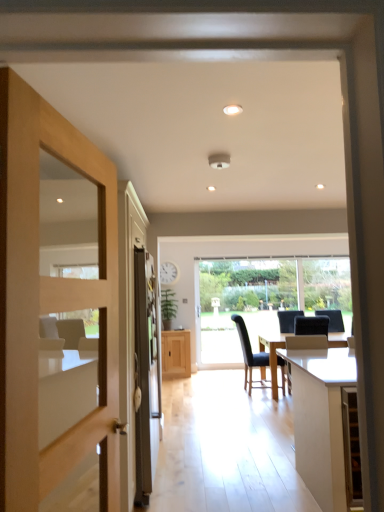
Question: Can you confirm if black leather chair at center, which is the second chair from left to right, is taller than white glossy table at lower right?

Choices:
 (A) no
 (B) yes

Answer: (B)

Question: From a real-world perspective, is black leather chair at center, which is the second chair from left to right, under white glossy table at lower right?

Choices:
 (A) yes
 (B) no

Answer: (B)

Question: Does black leather chair at center, which is counted as the first chair, starting from the right, appear on the right side of white glossy table at lower right?

Choices:
 (A) no
 (B) yes

Answer: (B)

Question: From a real-world perspective, is black leather chair at center, which is counted as the first chair, starting from the right, on top of white glossy table at lower right?

Choices:
 (A) no
 (B) yes

Answer: (B)

Question: Can you see black leather chair at center, which is counted as the first chair, starting from the right, touching white glossy table at lower right?

Choices:
 (A) yes
 (B) no

Answer: (B)

Question: Would you say transparent glass window at center is to the left or to the right of black leather chair at center, which is counted as the first chair, starting from the right, in the picture?

Choices:
 (A) left
 (B) right

Answer: (A)

Question: From the image's perspective, relative to black leather chair at center, which is the second chair from left to right, is transparent glass window at center above or below?

Choices:
 (A) above
 (B) below

Answer: (A)

Question: Is point (213, 333) positioned closer to the camera than point (322, 328)?

Choices:
 (A) farther
 (B) closer

Answer: (A)

Question: In terms of size, does transparent glass window at center appear bigger or smaller than black leather chair at center, which is the second chair from left to right?

Choices:
 (A) small
 (B) big

Answer: (A)

Question: Is light wood door at left spatially inside black leather chair at center, which is the second chair from left to right, or outside of it?

Choices:
 (A) outside
 (B) inside

Answer: (A)

Question: In the image, is light wood door at left on the left side or the right side of black leather chair at center, which is the second chair from left to right?

Choices:
 (A) left
 (B) right

Answer: (A)

Question: From the image's perspective, is light wood door at left located above or below black leather chair at center, which is the second chair from left to right?

Choices:
 (A) above
 (B) below

Answer: (A)

Question: Is light wood door at left taller or shorter than black leather chair at center, which is the second chair from left to right?

Choices:
 (A) tall
 (B) short

Answer: (A)

Question: Based on their sizes in the image, would you say light wood door at left is bigger or smaller than light oak cabinet at center?

Choices:
 (A) big
 (B) small

Answer: (B)

Question: Considering the relative positions of light wood door at left and light oak cabinet at center in the image provided, is light wood door at left to the left or to the right of light oak cabinet at center?

Choices:
 (A) left
 (B) right

Answer: (A)